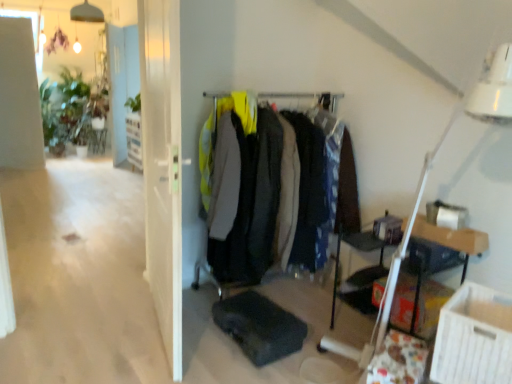
Question: Considering the relative sizes of matte black coat rack at center and white glossy door at upper center in the image provided, is matte black coat rack at center smaller than white glossy door at upper center?

Choices:
 (A) no
 (B) yes

Answer: (A)

Question: From a real-world perspective, does matte black coat rack at center sit lower than white glossy door at upper center?

Choices:
 (A) no
 (B) yes

Answer: (B)

Question: Is white glossy door at upper center completely or partially inside matte black coat rack at center?

Choices:
 (A) no
 (B) yes

Answer: (A)

Question: Considering the relative sizes of matte black coat rack at center and white glossy door at upper center in the image provided, is matte black coat rack at center thinner than white glossy door at upper center?

Choices:
 (A) yes
 (B) no

Answer: (B)

Question: Is matte black coat rack at center positioned behind white glossy door at upper center?

Choices:
 (A) yes
 (B) no

Answer: (B)

Question: Considering their positions, is green matte plant at upper left located in front of or behind transparent glass door at center?

Choices:
 (A) front
 (B) behind

Answer: (B)

Question: From a real-world perspective, is green matte plant at upper left above or below transparent glass door at center?

Choices:
 (A) above
 (B) below

Answer: (A)

Question: Is green matte plant at upper left situated inside transparent glass door at center or outside?

Choices:
 (A) inside
 (B) outside

Answer: (B)

Question: Based on their sizes in the image, would you say green matte plant at upper left is bigger or smaller than transparent glass door at center?

Choices:
 (A) big
 (B) small

Answer: (B)

Question: From a real-world perspective, is transparent glass door at center above or below matte black coat rack at center?

Choices:
 (A) above
 (B) below

Answer: (A)

Question: From the image's perspective, relative to matte black coat rack at center, is transparent glass door at center above or below?

Choices:
 (A) above
 (B) below

Answer: (A)

Question: Based on their positions, is transparent glass door at center located to the left or right of matte black coat rack at center?

Choices:
 (A) left
 (B) right

Answer: (A)

Question: Considering their positions, is transparent glass door at center located in front of or behind matte black coat rack at center?

Choices:
 (A) front
 (B) behind

Answer: (A)

Question: Is point (448, 342) closer or farther from the camera than point (122, 44)?

Choices:
 (A) farther
 (B) closer

Answer: (B)

Question: Based on their positions, is white cardboard box at lower right located to the left or right of white glossy door at upper center?

Choices:
 (A) right
 (B) left

Answer: (A)